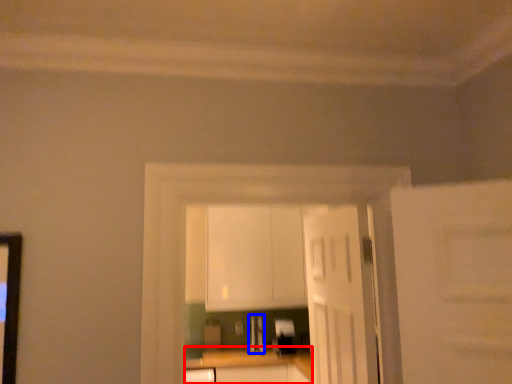
Question: Among these objects, which one is nearest to the camera, counter top (highlighted by a red box) or appliance (highlighted by a blue box)?

Choices:
 (A) counter top
 (B) appliance

Answer: (A)